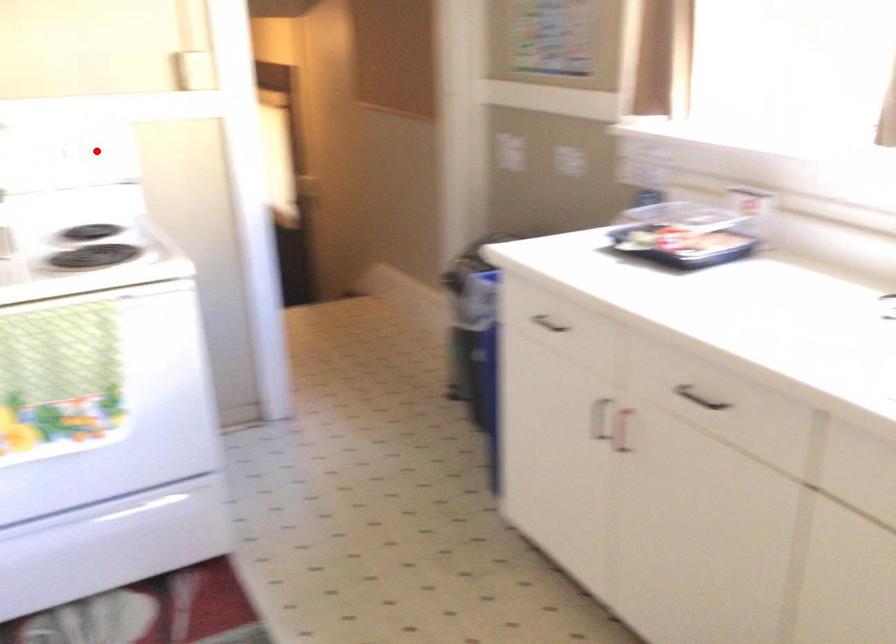
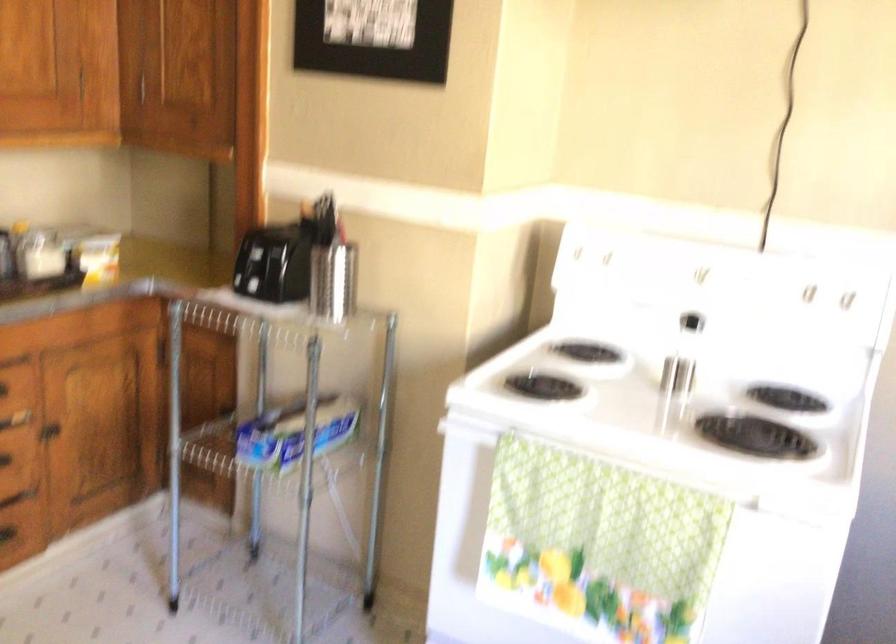
Locate, in the second image, the point that corresponds to the highlighted location in the first image.

(805, 292)